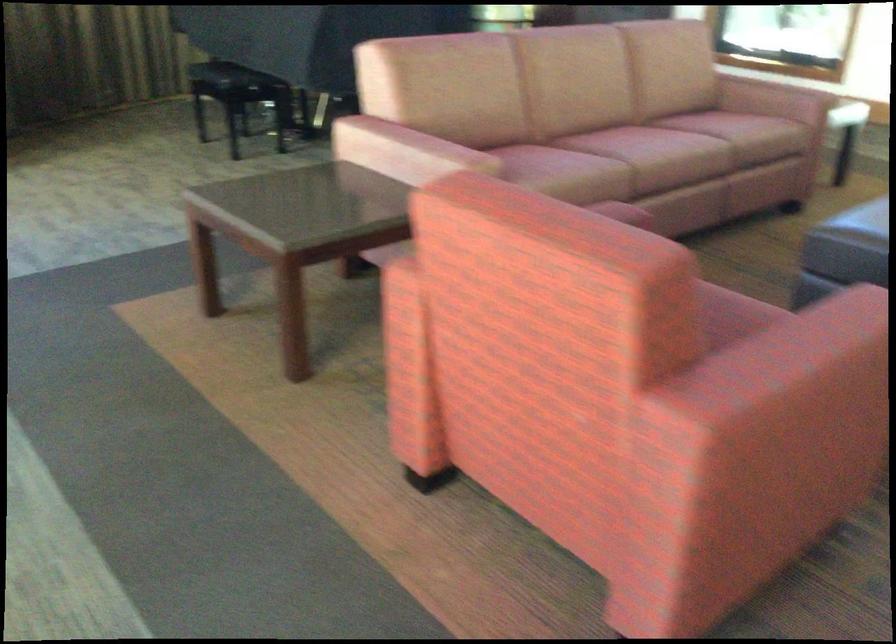
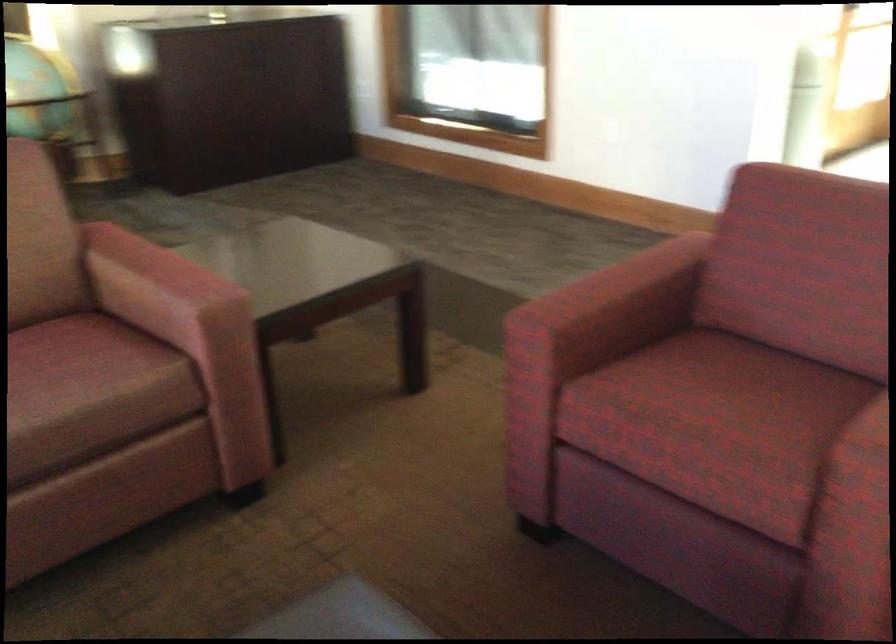
Looking at this image, which direction would the cameraman need to move to produce the second image?

The movement direction of the cameraman is right, forward.